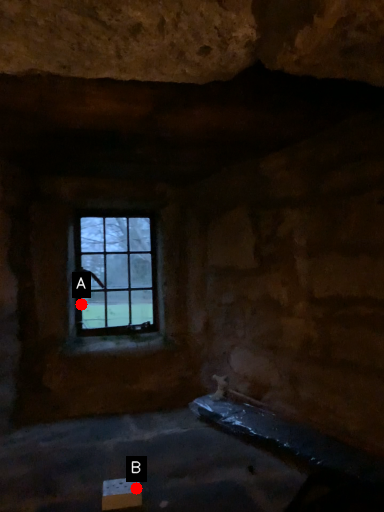
Question: Two points are circled on the image, labeled by A and B beside each circle. Among these points, which one is farthest from the camera?

Choices:
 (A) A is further
 (B) B is further

Answer: (A)